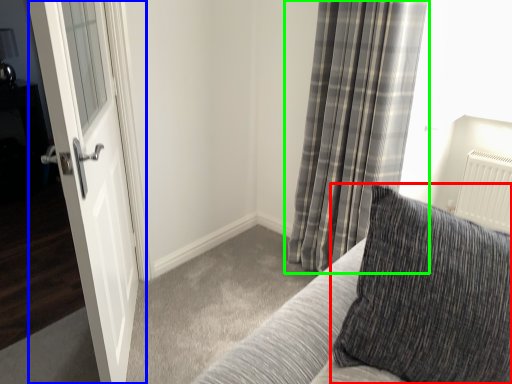
Question: Which object is positioned closest to pillow (highlighted by a red box)? Select from door (highlighted by a blue box) and curtain (highlighted by a green box).

Choices:
 (A) door
 (B) curtain

Answer: (A)